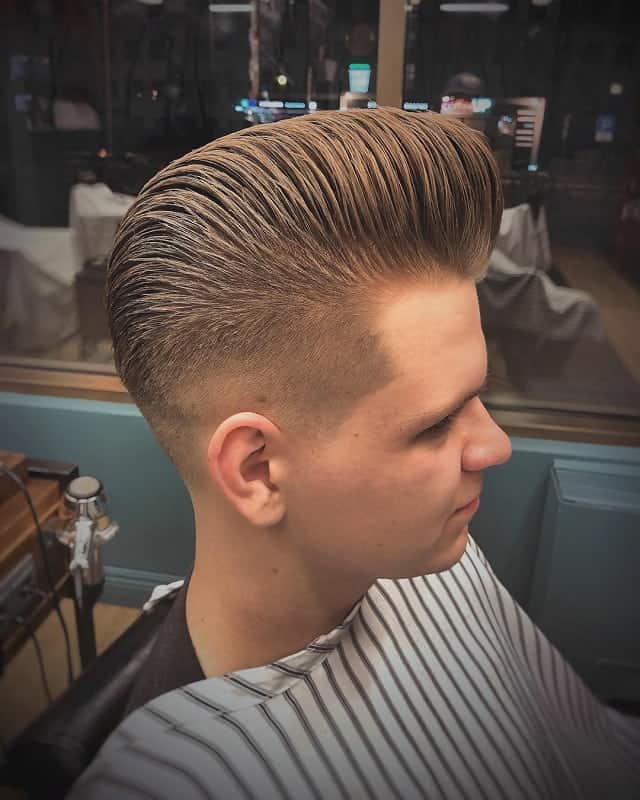
In order to click on salon chair in this screenshot , I will do `click(77, 710)`.